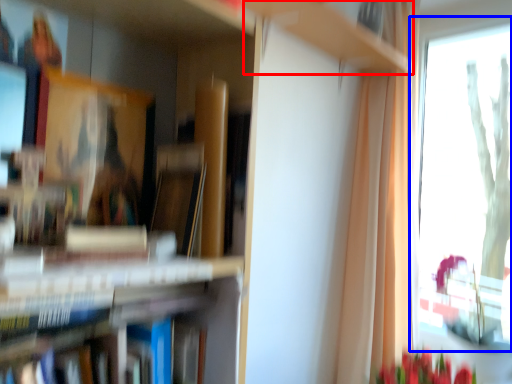
Question: Which of the following is the closest to the observer, cabinet (highlighted by a red box) or window (highlighted by a blue box)?

Choices:
 (A) cabinet
 (B) window

Answer: (A)